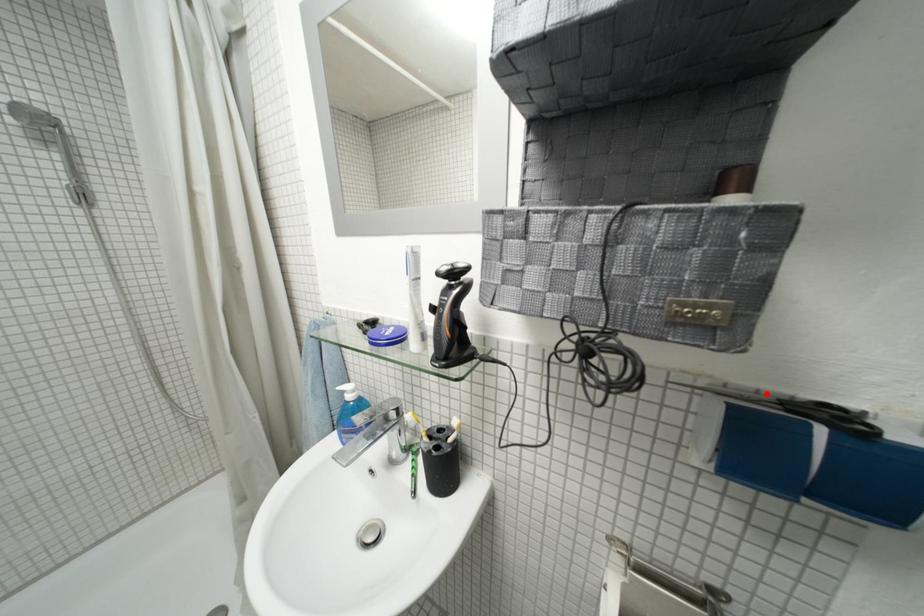
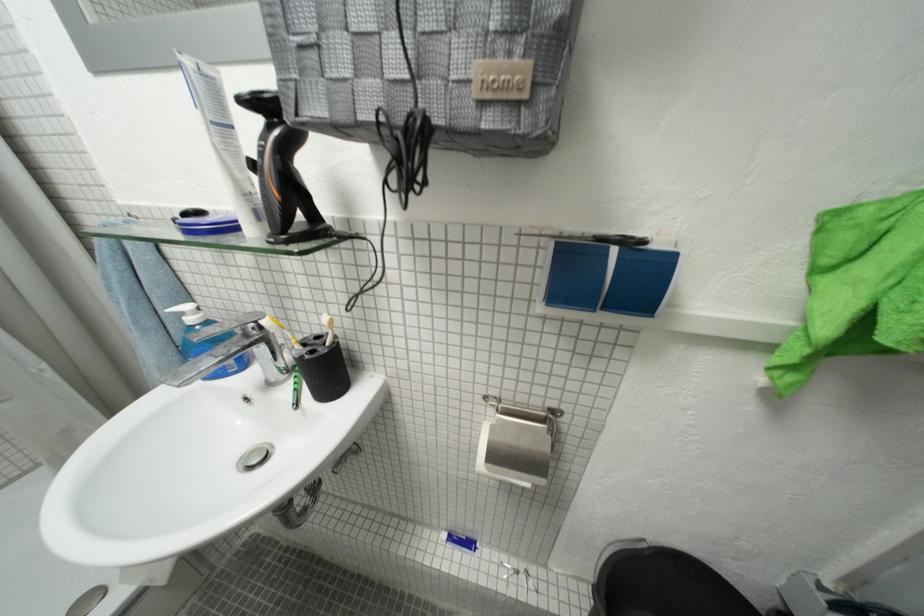
Where in the second image is the point corresponding to the highlighted location from the first image?

(592, 237)